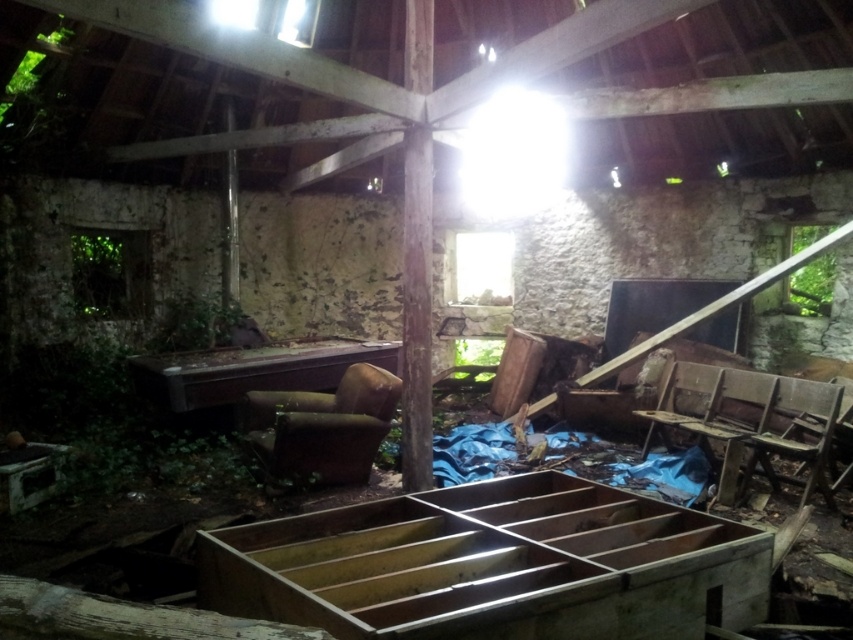
Question: Considering the relative positions of brown leather chair at center and worn wood chair at lower right in the image provided, where is brown leather chair at center located with respect to worn wood chair at lower right?

Choices:
 (A) right
 (B) left

Answer: (B)

Question: Where is wooden chair at right located in relation to worn wood chair at lower right in the image?

Choices:
 (A) above
 (B) below

Answer: (B)

Question: Which of the following is the closest to the observer?

Choices:
 (A) brown leather chair at center
 (B) wooden crate at center
 (C) worn wood chair at center-right
 (D) wooden chair at right

Answer: (B)

Question: Which point is closer to the camera?

Choices:
 (A) brown leather chair at center
 (B) wooden chair at right

Answer: (B)

Question: Which object is positioned farthest from the wooden chair at right?

Choices:
 (A) wooden desk at center
 (B) wooden crate at center
 (C) worn wood chair at center-right

Answer: (A)

Question: Can you confirm if brown leather chair at center is thinner than wooden desk at center?

Choices:
 (A) no
 (B) yes

Answer: (B)